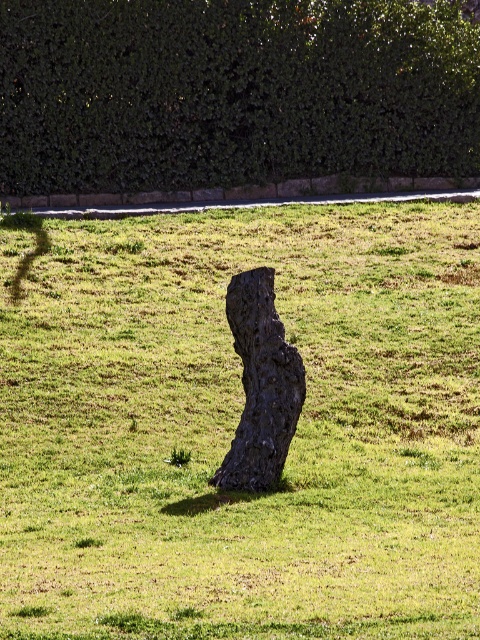
You are standing at the center of the grassy area and want to take a photo of the green leafy hedge at upper center. According to the coordinates provided, in which direction should you point your camera to capture it?

The green leafy hedge at upper center is located at coordinates point (231, 92), so you should point your camera slightly to the left and upwards to capture it.

You are a gardener planning to place a small decorative statue between the dark brown textured tree stump at center and the dark bark tree trunk at center. Given their sizes, which object should the statue be placed closer to to ensure it doesn

The dark brown textured tree stump at center is larger than the dark bark tree trunk at center. To ensure proper spacing, the statue should be placed closer to the smaller dark bark tree trunk at center so that it doesn